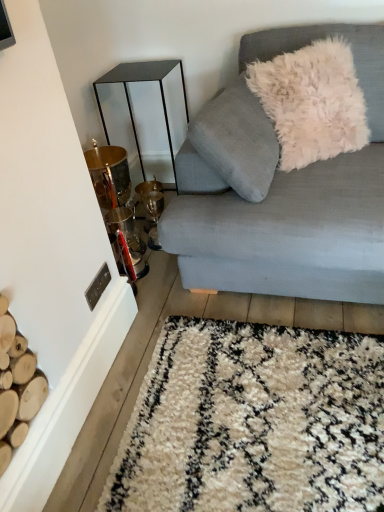
Describe the element at coordinates (312, 102) in the screenshot. This screenshot has height=512, width=384. I see `white fluffy pillow at upper right` at that location.

Image resolution: width=384 pixels, height=512 pixels. Describe the element at coordinates (138, 81) in the screenshot. I see `metallic gold table at left` at that location.

Image resolution: width=384 pixels, height=512 pixels. What do you see at coordinates (295, 204) in the screenshot? I see `light blue fabric couch at upper right` at bounding box center [295, 204].

Where is `white fluffy pillow at upper right`? white fluffy pillow at upper right is located at coordinates (312, 102).

In terms of width, does light blue fabric couch at upper right look wider or thinner when compared to white fluffy pillow at upper right?

Clearly, light blue fabric couch at upper right has more width compared to white fluffy pillow at upper right.

From the picture: Considering the relative positions of light blue fabric couch at upper right and white fluffy pillow at upper right in the image provided, is light blue fabric couch at upper right to the left or to the right of white fluffy pillow at upper right?

From the image, it's evident that light blue fabric couch at upper right is to the left of white fluffy pillow at upper right.

Does light blue fabric couch at upper right turn towards white fluffy pillow at upper right?

Yes, light blue fabric couch at upper right is oriented towards white fluffy pillow at upper right.

Based on the photo, is light blue fabric couch at upper right far away from white fluffy pillow at upper right?

light blue fabric couch at upper right is near white fluffy pillow at upper right, not far away.

Would you say metallic gold table at left is to the left or to the right of light blue fabric couch at upper right in the picture?

metallic gold table at left is to the left of light blue fabric couch at upper right.

Are metallic gold table at left and light blue fabric couch at upper right located far from each other?

No, there isn't a large distance between metallic gold table at left and light blue fabric couch at upper right.

Considering the relative sizes of metallic gold table at left and light blue fabric couch at upper right in the image provided, is metallic gold table at left wider than light blue fabric couch at upper right?

No.

Does metallic gold table at left have a larger size compared to light blue fabric couch at upper right?

Incorrect, metallic gold table at left is not larger than light blue fabric couch at upper right.

Which is correct: white fluffy pillow at upper right is inside light blue fabric couch at upper right, or outside of it?

white fluffy pillow at upper right is enclosed within light blue fabric couch at upper right.

How many degrees apart are the facing directions of white fluffy pillow at upper right and light blue fabric couch at upper right?

39.7 degrees.

Which is farther, (339, 130) or (289, 179)?

Positioned behind is point (339, 130).

What's the angular difference between white fluffy pillow at upper right and metallic gold table at left's facing directions?

They differ by 49 degrees in their facing directions.

From the image's perspective, is white fluffy pillow at upper right above or below metallic gold table at left?

white fluffy pillow at upper right is above metallic gold table at left.

Is white fluffy pillow at upper right oriented away from metallic gold table at left?

Yes, metallic gold table at left is at the back of white fluffy pillow at upper right.

From a real-world perspective, is metallic gold table at left above or below white fluffy pillow at upper right?

metallic gold table at left is below white fluffy pillow at upper right.

From the image's perspective, is metallic gold table at left over white fluffy pillow at upper right?

No, from the image's perspective, metallic gold table at left is not above white fluffy pillow at upper right.

Is metallic gold table at left in contact with white fluffy pillow at upper right?

No.

Which is more to the left, metallic gold table at left or white fluffy pillow at upper right?

From the viewer's perspective, metallic gold table at left appears more on the left side.

Does point (272, 29) lie in front of point (173, 170)?

Yes, it is.

In terms of width, does light blue fabric couch at upper right look wider or thinner when compared to metallic gold table at left?

light blue fabric couch at upper right is wider than metallic gold table at left.

Does light blue fabric couch at upper right have a larger size compared to metallic gold table at left?

Yes.

Which is more to the right, light blue fabric couch at upper right or metallic gold table at left?

Positioned to the right is light blue fabric couch at upper right.

Where is `studio couch that appears on the left of white fluffy pillow at upper right`? The width and height of the screenshot is (384, 512). studio couch that appears on the left of white fluffy pillow at upper right is located at coordinates (295, 204).

At what (x,y) coordinates should I click in order to perform the action: click on table located behind the light blue fabric couch at upper right. Please return your answer as a coordinate pair (x, y). Image resolution: width=384 pixels, height=512 pixels. Looking at the image, I should click on (138, 81).

From the image, which object appears to be nearer to white fluffy pillow at upper right, light blue fabric couch at upper right or metallic gold table at left?

light blue fabric couch at upper right.

Consider the image. Which object lies further to the anchor point light blue fabric couch at upper right, white fluffy pillow at upper right or metallic gold table at left?

metallic gold table at left is further to light blue fabric couch at upper right.

When comparing their distances from metallic gold table at left, does white fluffy pillow at upper right or light blue fabric couch at upper right seem further?

light blue fabric couch at upper right is positioned further to the anchor metallic gold table at left.

When comparing their distances from metallic gold table at left, does light blue fabric couch at upper right or white fluffy pillow at upper right seem further?

Among the two, light blue fabric couch at upper right is located further to metallic gold table at left.

Based on their spatial positions, is metallic gold table at left or light blue fabric couch at upper right further from white fluffy pillow at upper right?

The object further to white fluffy pillow at upper right is metallic gold table at left.

Looking at the image, which one is located closer to light blue fabric couch at upper right, metallic gold table at left or white fluffy pillow at upper right?

white fluffy pillow at upper right is positioned closer to the anchor light blue fabric couch at upper right.

Identify the location of throw pillow between light blue fabric couch at upper right and metallic gold table at left from front to back. (312, 102).